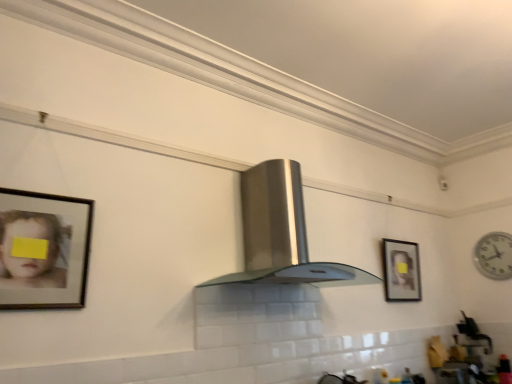
Question: Is wooden framed portrait at center right, the second picture frame from the front, oriented away from white plastic clock at right?

Choices:
 (A) no
 (B) yes

Answer: (A)

Question: From the image's perspective, is wooden framed portrait at center right, the second picture frame from the front, under white plastic clock at right?

Choices:
 (A) yes
 (B) no

Answer: (A)

Question: Can you confirm if wooden framed portrait at center right, acting as the first picture frame starting from the right, is thinner than white plastic clock at right?

Choices:
 (A) no
 (B) yes

Answer: (A)

Question: From a real-world perspective, is wooden framed portrait at center right, acting as the first picture frame starting from the right, physically below white plastic clock at right?

Choices:
 (A) yes
 (B) no

Answer: (A)

Question: From a real-world perspective, is wooden framed portrait at center right, placed as the 1th picture frame when sorted from back to front, on top of white plastic clock at right?

Choices:
 (A) no
 (B) yes

Answer: (A)

Question: In terms of height, does wooden framed portrait at left, the first picture frame viewed from the front, look taller or shorter compared to wooden framed portrait at center right, placed as the 1th picture frame when sorted from back to front?

Choices:
 (A) short
 (B) tall

Answer: (A)

Question: From the image's perspective, is wooden framed portrait at left, the first picture frame viewed from the front, above or below wooden framed portrait at center right, acting as the first picture frame starting from the right?

Choices:
 (A) below
 (B) above

Answer: (B)

Question: Considering the positions of point (59, 266) and point (404, 251), is point (59, 266) closer or farther from the camera than point (404, 251)?

Choices:
 (A) farther
 (B) closer

Answer: (B)

Question: Is wooden framed portrait at left, positioned as the first picture frame in left-to-right order, inside or outside of wooden framed portrait at center right, placed as the 1th picture frame when sorted from back to front?

Choices:
 (A) outside
 (B) inside

Answer: (A)

Question: In terms of width, does stainless steel fume hood at center look wider or thinner when compared to wooden framed portrait at left, the second picture frame positioned from the back?

Choices:
 (A) wide
 (B) thin

Answer: (A)

Question: From the image's perspective, is stainless steel fume hood at center positioned above or below wooden framed portrait at left, the first picture frame viewed from the front?

Choices:
 (A) below
 (B) above

Answer: (B)

Question: From a real-world perspective, is stainless steel fume hood at center positioned above or below wooden framed portrait at left, the second picture frame positioned from the back?

Choices:
 (A) below
 (B) above

Answer: (B)

Question: Is point (276, 173) closer or farther from the camera than point (84, 243)?

Choices:
 (A) farther
 (B) closer

Answer: (A)

Question: Considering the positions of point (497, 276) and point (250, 243), is point (497, 276) closer or farther from the camera than point (250, 243)?

Choices:
 (A) farther
 (B) closer

Answer: (A)

Question: In terms of size, does white plastic clock at right appear bigger or smaller than stainless steel fume hood at center?

Choices:
 (A) small
 (B) big

Answer: (A)